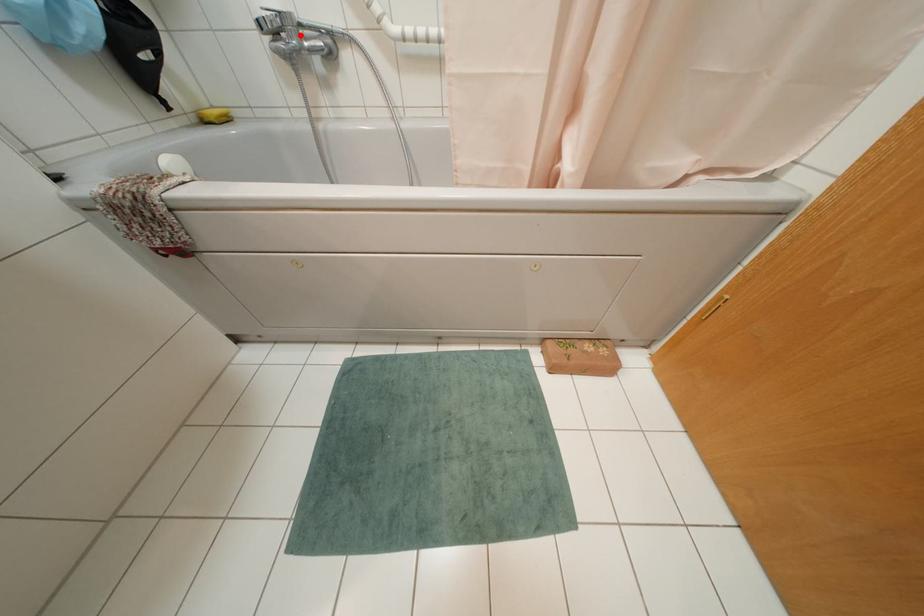
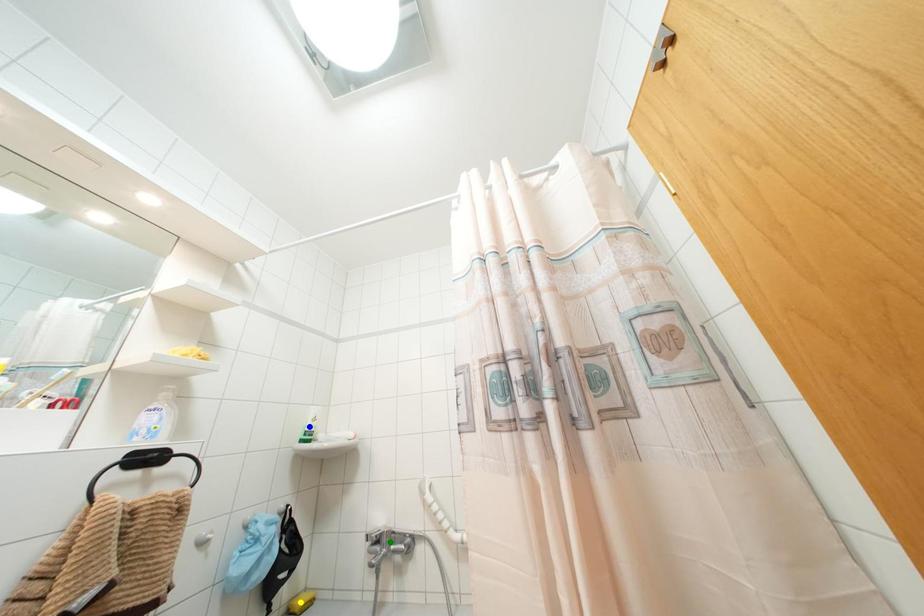
Question: I am providing you with two images of the same scene from different viewpoints. A red point is marked on the first image. You are given multiple points on the second image. In image 2, which mark is for the same physical point as the one in image 1?

Choices:
 (A) green point
 (B) blue point
 (C) yellow point

Answer: (A)